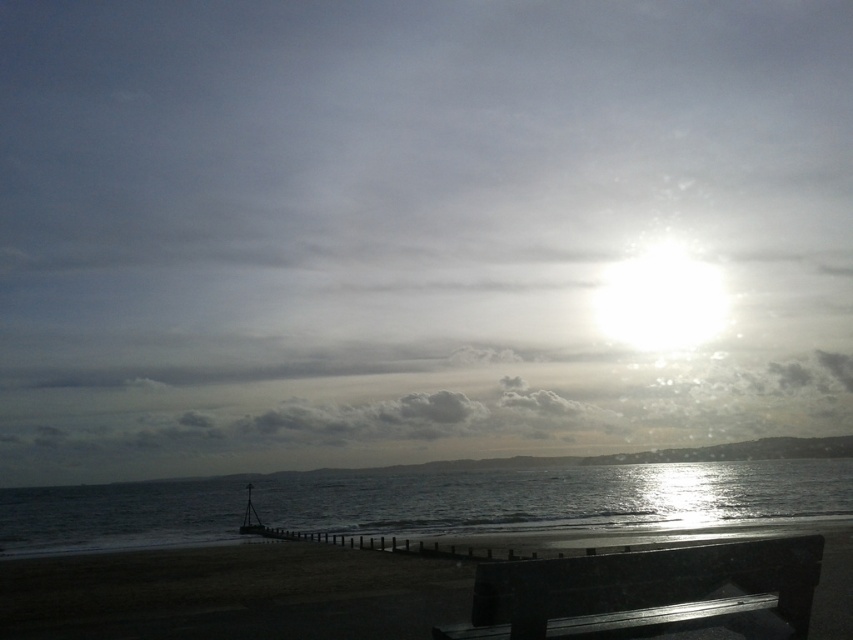
Question: Does dark sand at lower center come in front of black polished wood bench at lower center?

Choices:
 (A) yes
 (B) no

Answer: (B)

Question: In this image, where is shiny metallic water at lower center located relative to dark sand at lower center?

Choices:
 (A) above
 (B) below

Answer: (B)

Question: Can you confirm if dark sand at lower center is wider than black polished wood bench at lower center?

Choices:
 (A) no
 (B) yes

Answer: (B)

Question: Among these objects, which one is farthest from the camera?

Choices:
 (A) shiny metallic water at lower center
 (B) black polished wood bench at lower center
 (C) dark sand at lower center

Answer: (A)

Question: Estimate the real-world distances between objects in this image. Which object is farther from the shiny metallic water at lower center?

Choices:
 (A) dark sand at lower center
 (B) black polished wood bench at lower center

Answer: (B)

Question: Which point appears farthest from the camera in this image?

Choices:
 (A) (445, 509)
 (B) (730, 572)

Answer: (A)